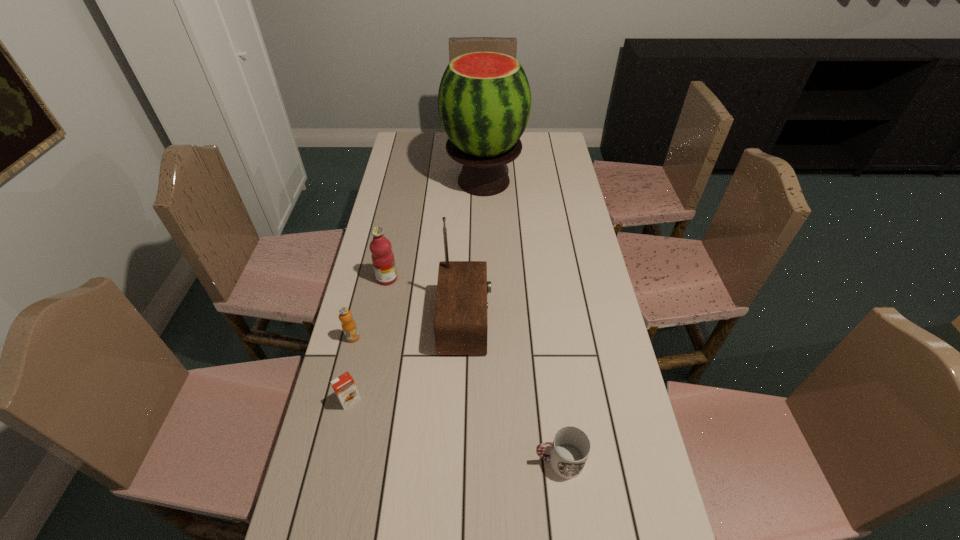
Locate an element on the screen. The image size is (960, 540). free space at the left edge of the desktop is located at coordinates (350, 509).

Find the location of a particular element. This screenshot has width=960, height=540. vacant space at the right edge of the desktop is located at coordinates (553, 246).

Image resolution: width=960 pixels, height=540 pixels. I want to click on vacant space at the far left corner of the desktop, so click(x=395, y=150).

Locate an element on the screen. The width and height of the screenshot is (960, 540). free space between the second tallest object and the taller orange juice is located at coordinates (409, 330).

Where is `empty location between the third shortest object and the shorter orange juice`? This screenshot has width=960, height=540. empty location between the third shortest object and the shorter orange juice is located at coordinates (351, 369).

Identify the location of empty space between the fruit juice and the cup. (473, 370).

Where is `free spot between the fourth tallest object and the cup`? free spot between the fourth tallest object and the cup is located at coordinates (456, 399).

The width and height of the screenshot is (960, 540). In order to click on free area in between the cup and the shorter orange juice in this screenshot , I will do `click(454, 431)`.

What are the coordinates of `free spot between the nearest object and the radio receiver` in the screenshot? It's located at (512, 392).

Identify the location of free spot between the tallest object and the nearer orange juice. This screenshot has width=960, height=540. (417, 291).